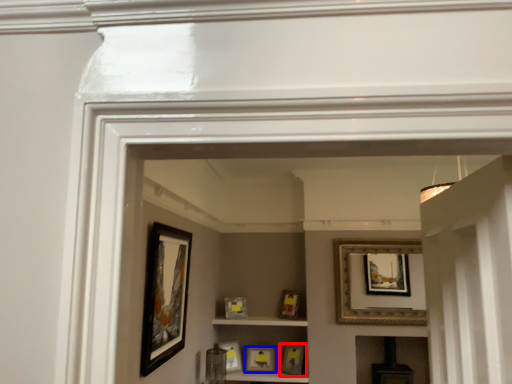
Question: Which object appears closest to the camera in this image, picture frame (highlighted by a red box) or picture frame (highlighted by a blue box)?

Choices:
 (A) picture frame
 (B) picture frame

Answer: (A)